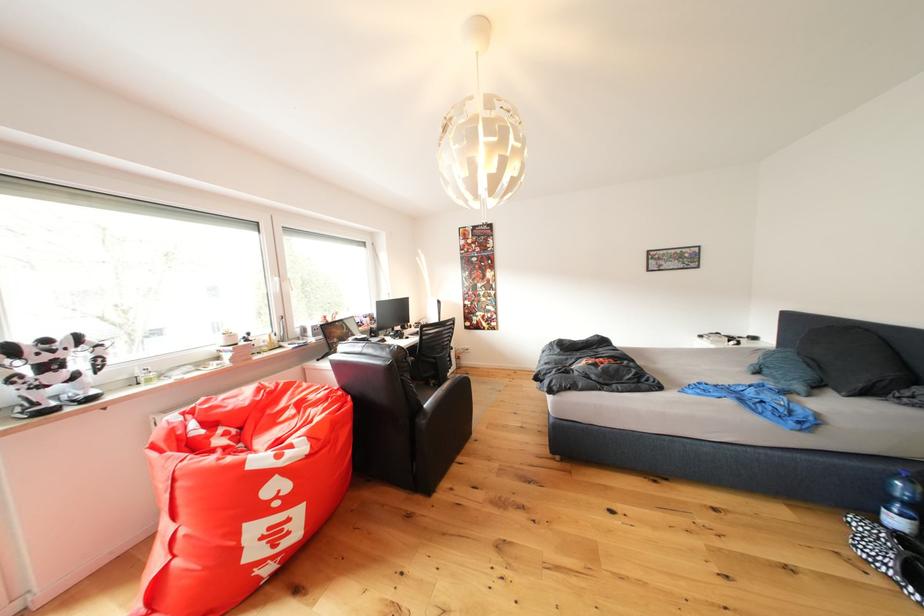
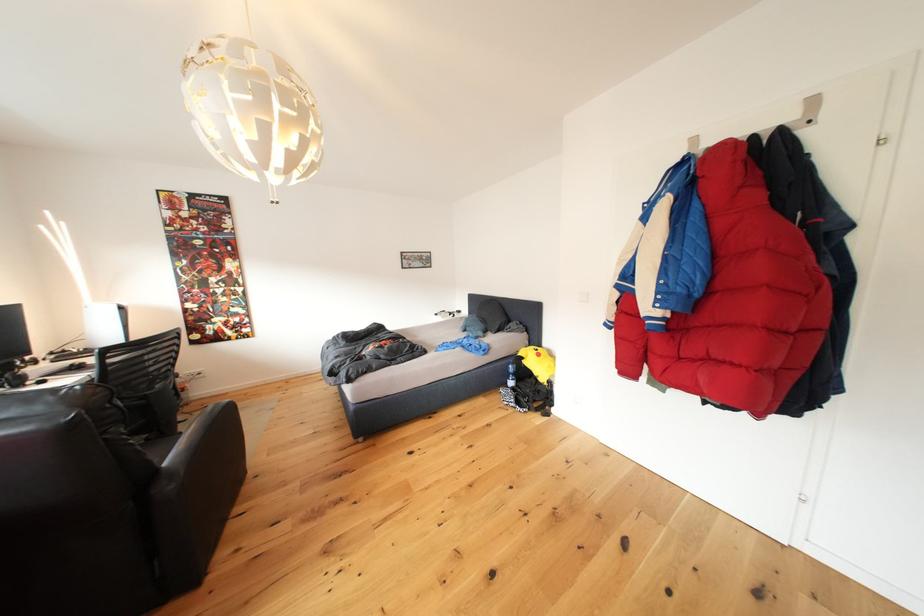
Question: The first image is from the beginning of the video and the second image is from the end. How did the camera likely rotate when shooting the video?

Choices:
 (A) Left
 (B) Right
 (C) Up
 (D) Down

Answer: (B)